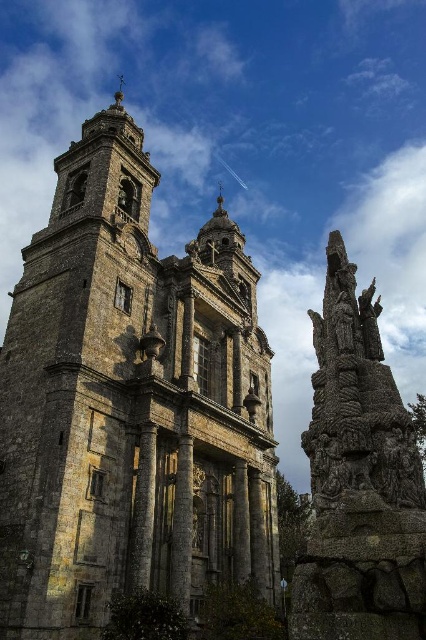
You are an architect assessing the spatial layout of the church and its adjacent sculpture. Given that the stone tower at center and the rustic stone sculpture at right are both made of stone, which one would require more material in terms of width if you were to replicate them at the same height?

The stone tower at center requires more material in terms of width because its width is larger than the rustic stone sculpture at right.

You are an architect assessing the proportions of the church and its surroundings. Given the stone tower at center and the rustic stone sculpture at right, which one would you recommend to a client wanting to emphasize grandeur and scale in their design?

The stone tower at center is larger in size than the rustic stone sculpture at right, so it would be the better choice to emphasize grandeur and scale in the design.

You are an architect analyzing the spatial arrangement of the church and sculpture. Based on the image, which object is placed higher relative to the other between the stone tower at center and the rustic stone sculpture at right?

The stone tower at center is positioned over the rustic stone sculpture at right, meaning it is higher in elevation.